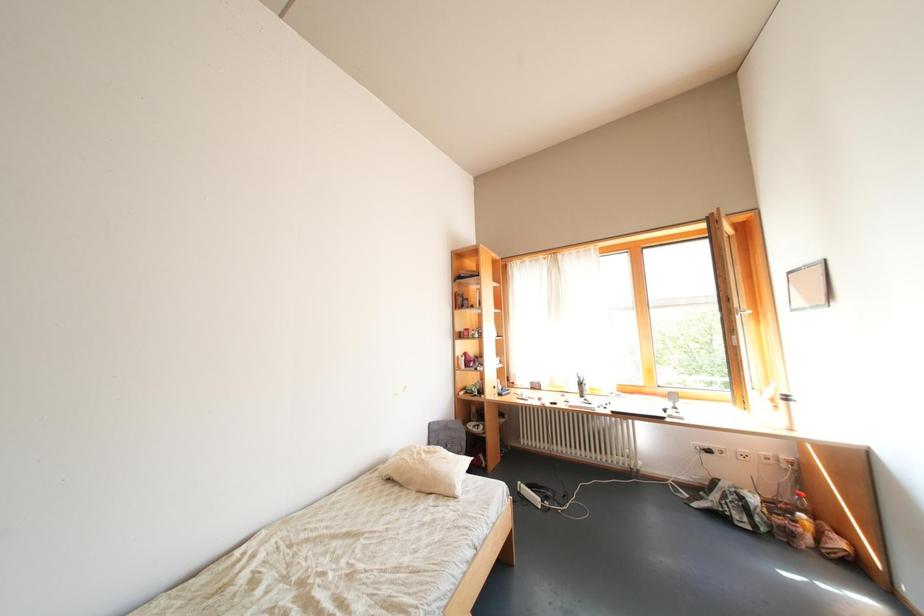
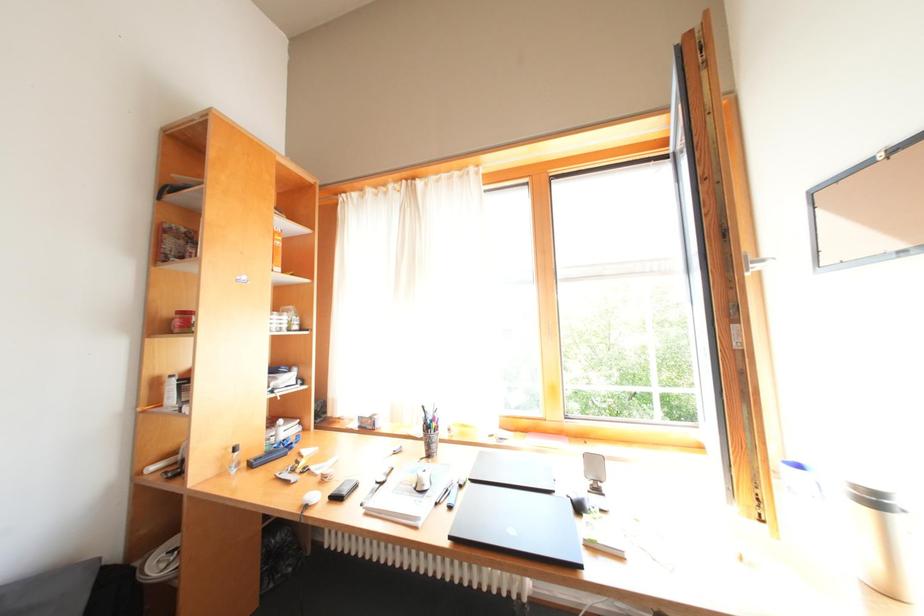
Looking at this image, the images are taken continuously from a first-person perspective. In which direction are you moving?

The movement direction of the cameraman is right, forward.